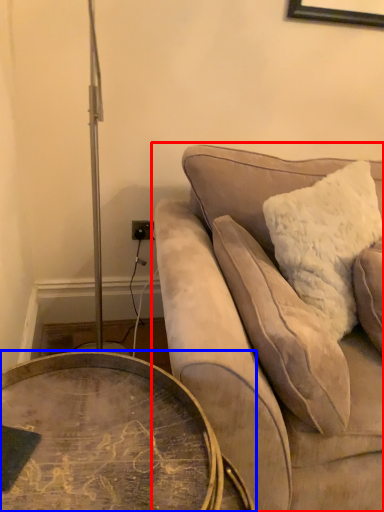
Question: Among these objects, which one is farthest to the camera, studio couch (highlighted by a red box) or coffee table (highlighted by a blue box)?

Choices:
 (A) studio couch
 (B) coffee table

Answer: (A)